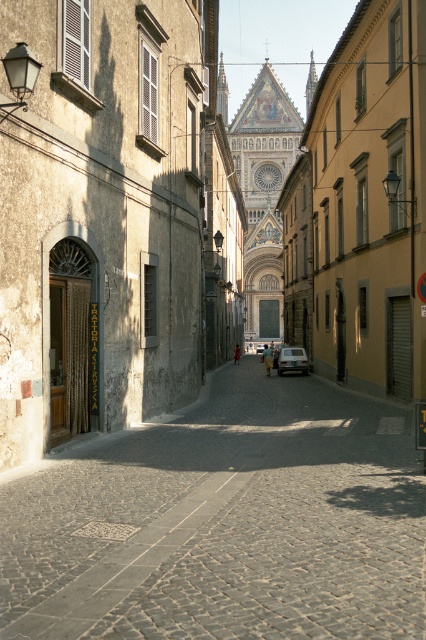
Is point (241, 392) positioned in front of point (284, 358)?

Yes, it is in front of point (284, 358).

Between gray cobblestone alley at center and silver metallic car at center, which one has more height?

silver metallic car at center is taller.

Who is more distant from viewer, [65,600] or [302,360]?

The point [302,360] is more distant.

At what (x,y) coordinates should I click in order to perform the action: click on gray cobblestone alley at center. Please return your answer as a coordinate pair (x, y). This screenshot has height=640, width=426. Looking at the image, I should click on (224, 522).

Between stone paved street at center and gray cobblestone alley at center, which one has less height?

Standing shorter between the two is gray cobblestone alley at center.

This screenshot has height=640, width=426. I want to click on stone paved street at center, so click(199, 212).

The image size is (426, 640). I want to click on stone paved street at center, so click(x=199, y=212).

Between stone paved street at center and silver metallic car at center, which one is positioned lower?

silver metallic car at center

Does stone paved street at center have a greater height compared to silver metallic car at center?

Correct, stone paved street at center is much taller as silver metallic car at center.

Image resolution: width=426 pixels, height=640 pixels. What are the coordinates of `stone paved street at center` in the screenshot? It's located at (199, 212).

Identify the location of stone paved street at center. The image size is (426, 640). (199, 212).